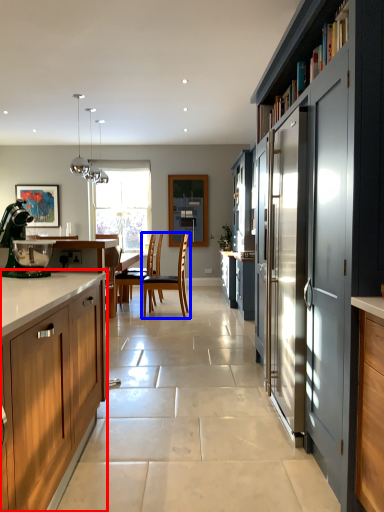
Question: Which of the following is the closest to the observer, cabinetry (highlighted by a red box) or chair (highlighted by a blue box)?

Choices:
 (A) cabinetry
 (B) chair

Answer: (A)